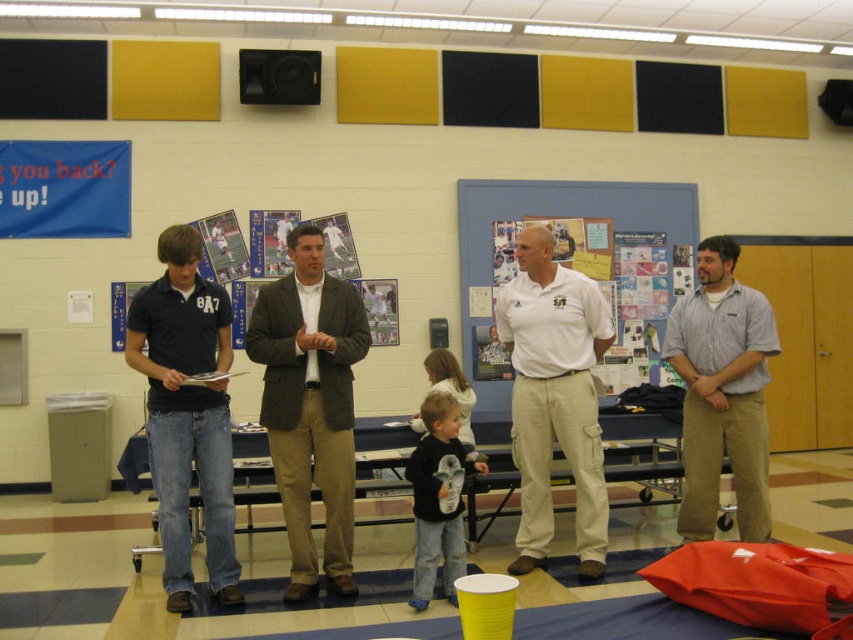
Consider the image. Does white cotton shirt at center have a smaller size compared to blue matte bulletin board at center?

Correct, white cotton shirt at center occupies less space than blue matte bulletin board at center.

At what (x,y) coordinates should I click in order to perform the action: click on white cotton shirt at center. Please return your answer as a coordinate pair (x, y). The width and height of the screenshot is (853, 640). Looking at the image, I should click on (554, 396).

Which is in front, point (518, 260) or point (459, 193)?

Positioned in front is point (518, 260).

Identify the location of white cotton shirt at center. This screenshot has height=640, width=853. (x=554, y=396).

At what (x,y) coordinates should I click in order to perform the action: click on brown textured blazer at center. Please return your answer as a coordinate pair (x, y). Image resolution: width=853 pixels, height=640 pixels. Looking at the image, I should click on (310, 404).

Is brown textured blazer at center below gray cotton shirt at right?

Correct, brown textured blazer at center is located below gray cotton shirt at right.

Which is behind, point (257, 332) or point (759, 500)?

The point (759, 500) is more distant.

The image size is (853, 640). Identify the location of brown textured blazer at center. (310, 404).

Describe the element at coordinates (722, 392) in the screenshot. I see `gray cotton shirt at right` at that location.

Can you confirm if gray cotton shirt at right is positioned above black cotton shirt at center?

Yes.

Where is `gray cotton shirt at right`? The image size is (853, 640). gray cotton shirt at right is located at coordinates (722, 392).

You are a GUI agent. You are given a task and a screenshot of the screen. Output one action in this format:
    pyautogui.click(x=<x>, y=<y>)
    Task: Click on the gray cotton shirt at right
    This screenshot has height=640, width=853.
    Given the screenshot: What is the action you would take?
    pyautogui.click(x=722, y=392)